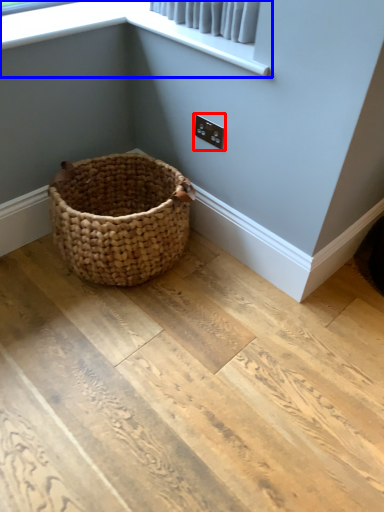
Question: Among these objects, which one is nearest to the camera, electric outlet (highlighted by a red box) or window screen (highlighted by a blue box)?

Choices:
 (A) electric outlet
 (B) window screen

Answer: (B)